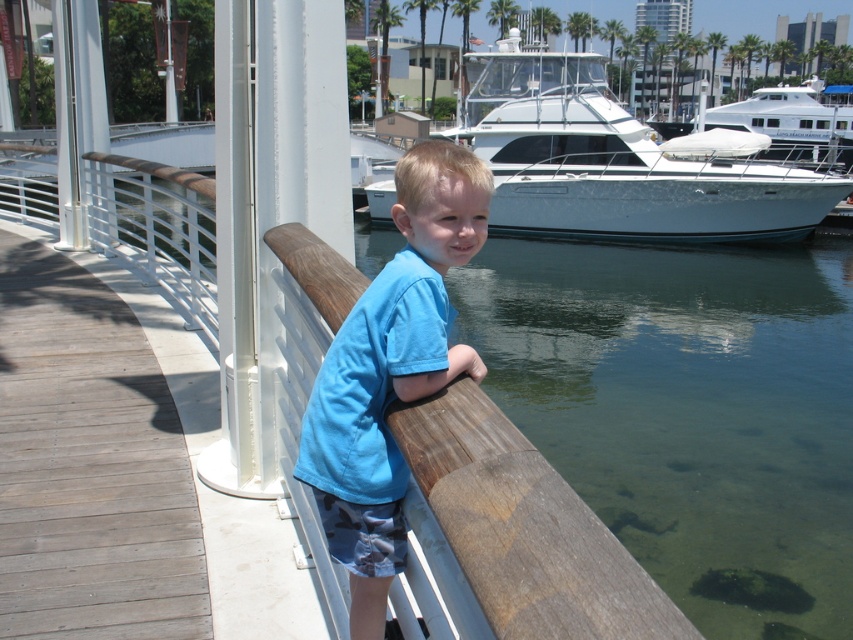
You are standing on the wooden deck and want to know where the white glossy boat at upper center is located in the image. Can you tell me its coordinates?

The white glossy boat at upper center is located at coordinates (x=612, y=163).

You are a photographer trying to capture the entire scene of the gray wood deck at lower left and the white glossy boat at upper center in one shot. Based on their sizes in the image, which object should you focus on to ensure both are visible without cropping?

The gray wood deck at lower left occupies less space than the white glossy boat at upper center. To capture both in one shot, focus on the larger object, the white glossy boat at upper center, as it takes up more of the frame, ensuring the smaller deck remains visible.